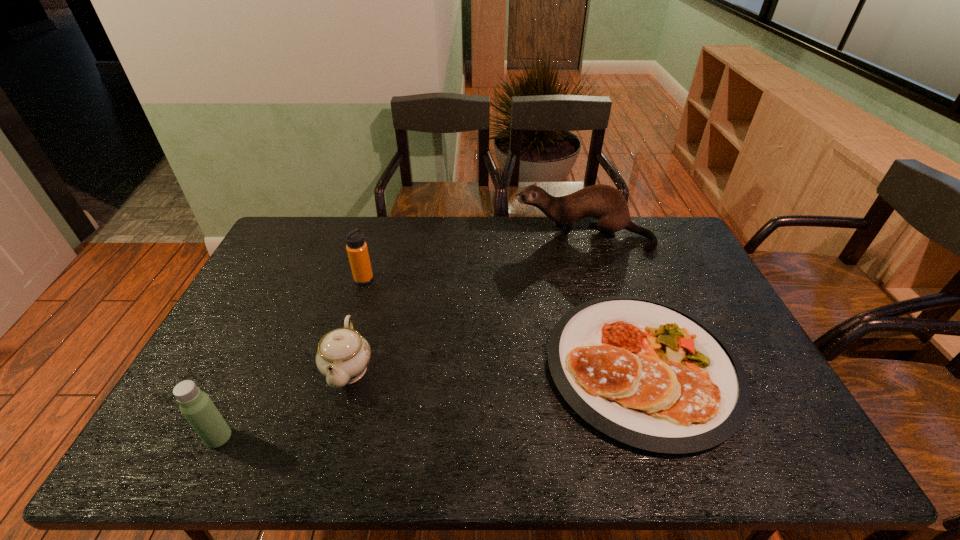
Identify the location of vacant space situated 0.290m on the front of the right thermos bottle. (341, 357).

Locate an element on the screen. This screenshot has height=540, width=960. free space located 0.350m on the right of the nearer thermos bottle is located at coordinates (381, 437).

Identify the location of vacant position located at the spout of the second shortest object. (323, 460).

The height and width of the screenshot is (540, 960). In order to click on vacant space situated on the back of the shortest object in this screenshot , I will do `click(597, 235)`.

This screenshot has width=960, height=540. In order to click on object present at the far edge in this screenshot , I will do `click(603, 202)`.

I want to click on thermos bottle that is positioned at the near edge, so click(196, 406).

Where is `dish present at the near edge`? dish present at the near edge is located at coordinates (647, 374).

Find the location of a particular element. object located at the left edge is located at coordinates (196, 406).

You are a GUI agent. You are given a task and a screenshot of the screen. Output one action in this format:
    pyautogui.click(x=<x>, y=<y>)
    Task: Click on the ferret located at the right edge
    Image resolution: width=960 pixels, height=540 pixels.
    Given the screenshot: What is the action you would take?
    pyautogui.click(x=603, y=202)

Where is `dish situated at the right edge`? This screenshot has height=540, width=960. dish situated at the right edge is located at coordinates (647, 374).